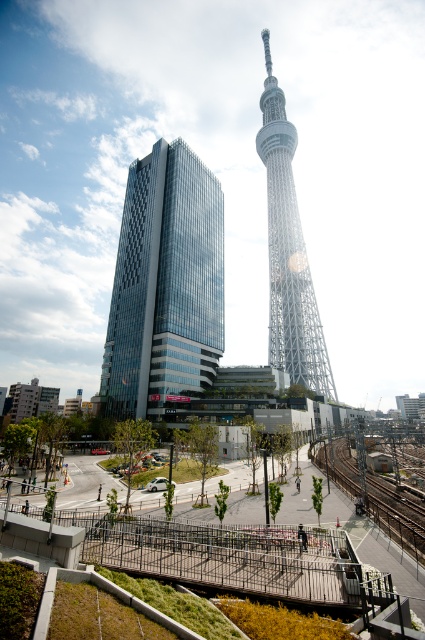
You are a photographer standing at the lower center of the image, where the metal train track at lower center begins. You want to capture a photo of the glassy modern building at center in the background. Will the building appear larger or smaller in the photo compared to the train track?

The glassy modern building at center is taller than the metal train track at lower center, so in the photo, the building will appear larger than the train track.

You are a photographer standing at the lower center of the image, where the metal train track at lower center is located. You want to capture a photo of the white lattice tower at center in the background. Will the tower appear taller than the train track in your photo?

The white lattice tower at center is taller than the metal train track at lower center, so yes, the tower will appear taller in the photo.

You are a tourist standing in the middle of the city square, looking at the glassy modern building at center and the white lattice tower at center. Which one is positioned to the left side?

The glassy modern building at center is positioned to the left of the white lattice tower at center.